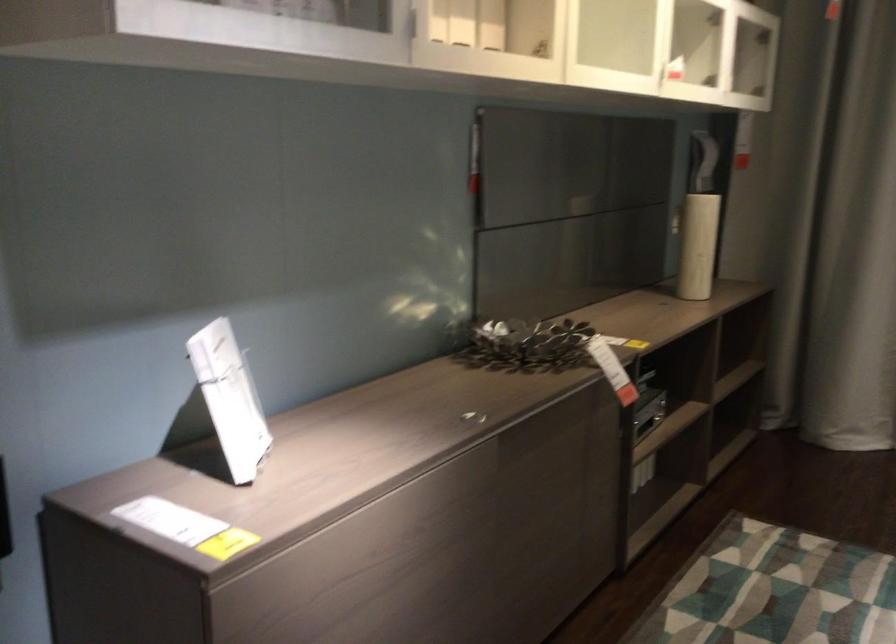
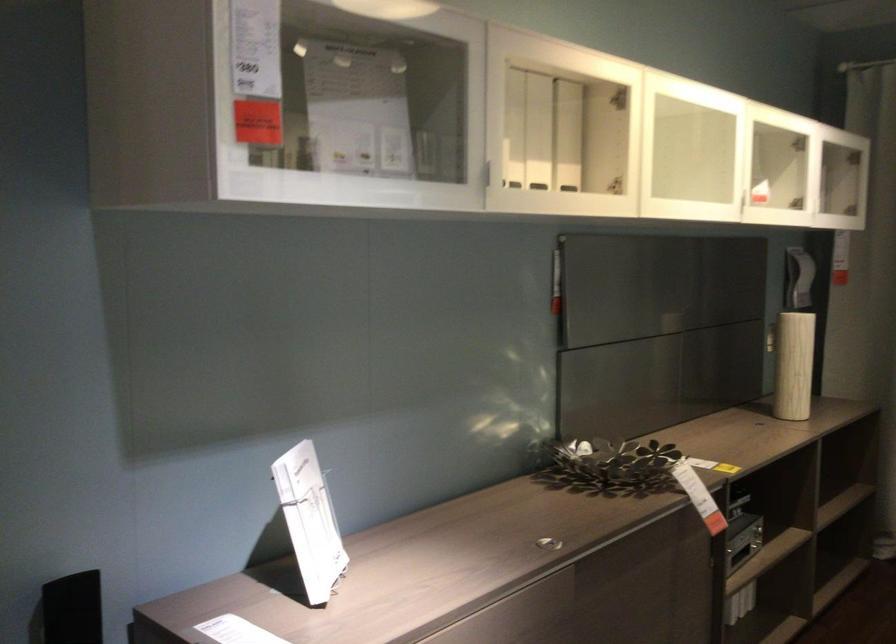
In the second image, find the point that corresponds to the point at 702,243 in the first image.

(794, 365)